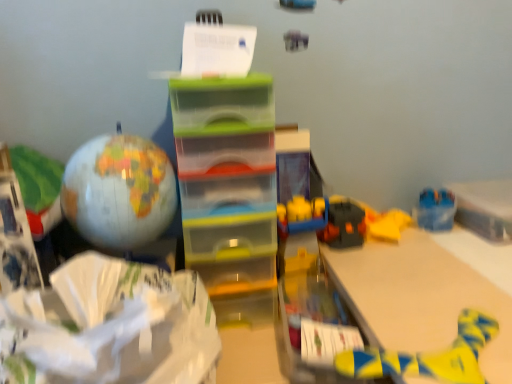
Question: From the image's perspective, is yellow fabric toy at lower right located above white matte wrapping paper at lower left?

Choices:
 (A) no
 (B) yes

Answer: (A)

Question: Is yellow fabric toy at lower right not near white matte wrapping paper at lower left?

Choices:
 (A) no
 (B) yes

Answer: (A)

Question: Is yellow fabric toy at lower right located outside white matte wrapping paper at lower left?

Choices:
 (A) no
 (B) yes

Answer: (B)

Question: Is the depth of yellow fabric toy at lower right greater than that of white matte wrapping paper at lower left?

Choices:
 (A) no
 (B) yes

Answer: (A)

Question: Is yellow fabric toy at lower right to the right of white matte wrapping paper at lower left from the viewer's perspective?

Choices:
 (A) no
 (B) yes

Answer: (B)

Question: From the image's perspective, is yellow fabric toy at lower right above or below white paper at upper center?

Choices:
 (A) above
 (B) below

Answer: (B)

Question: Based on their sizes in the image, would you say yellow fabric toy at lower right is bigger or smaller than white paper at upper center?

Choices:
 (A) small
 (B) big

Answer: (A)

Question: In terms of height, does yellow fabric toy at lower right look taller or shorter compared to white paper at upper center?

Choices:
 (A) tall
 (B) short

Answer: (B)

Question: From a real-world perspective, is yellow fabric toy at lower right above or below white paper at upper center?

Choices:
 (A) above
 (B) below

Answer: (B)

Question: Looking at the image, does matte globe at left seem bigger or smaller compared to white matte wrapping paper at lower left?

Choices:
 (A) small
 (B) big

Answer: (A)

Question: Would you say matte globe at left is inside or outside white matte wrapping paper at lower left?

Choices:
 (A) outside
 (B) inside

Answer: (A)

Question: Is matte globe at left taller or shorter than white matte wrapping paper at lower left?

Choices:
 (A) short
 (B) tall

Answer: (B)

Question: From a real-world perspective, is matte globe at left above or below white matte wrapping paper at lower left?

Choices:
 (A) below
 (B) above

Answer: (B)

Question: Looking at their shapes, would you say yellow fabric toy at lower right is wider or thinner than matte globe at left?

Choices:
 (A) thin
 (B) wide

Answer: (B)

Question: From a real-world perspective, is yellow fabric toy at lower right positioned above or below matte globe at left?

Choices:
 (A) below
 (B) above

Answer: (A)